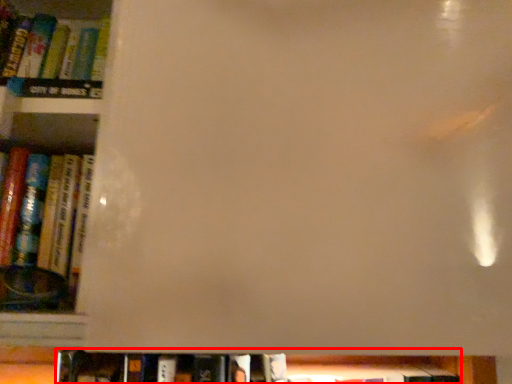
Question: From the image's perspective, what is the correct spatial positioning of book (annotated by the red box) in reference to book?

Choices:
 (A) above
 (B) below

Answer: (B)